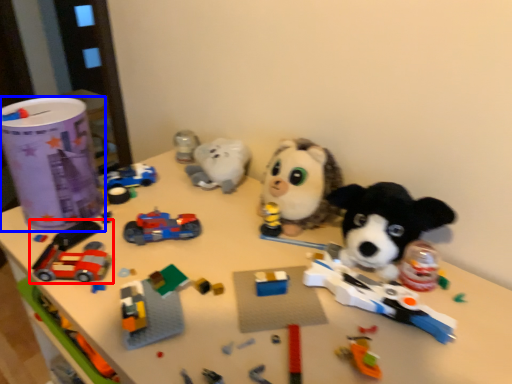
Question: Which object is closer to the camera taking this photo, toy (highlighted by a red box) or toy (highlighted by a blue box)?

Choices:
 (A) toy
 (B) toy

Answer: (A)